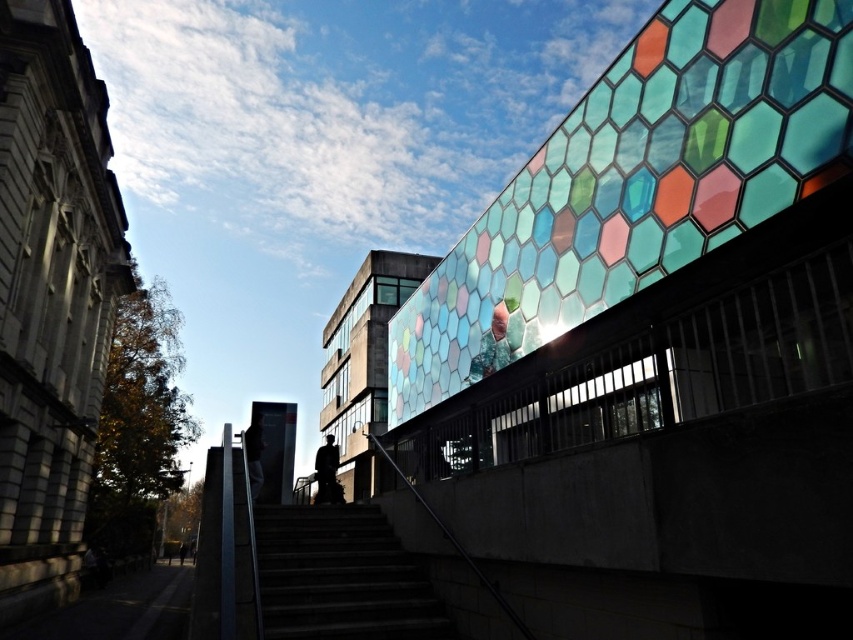
Is point (566, 141) positioned in front of point (254, 547)?

No.

Is multicolored hexagonal glass at upper right below dark concrete stairs at center?

Actually, multicolored hexagonal glass at upper right is above dark concrete stairs at center.

Is point (621, 268) behind point (341, 586)?

No, (621, 268) is closer to viewer.

You are a GUI agent. You are given a task and a screenshot of the screen. Output one action in this format:
    pyautogui.click(x=<x>, y=<y>)
    Task: Click on the multicolored hexagonal glass at upper right
    The image size is (853, 640).
    Given the screenshot: What is the action you would take?
    636,184